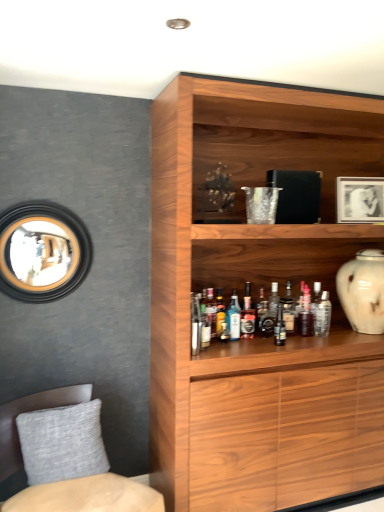
Question: Is translucent glass bottle at shelf center, positioned as the sixth bottle in right-to-left order, wider or thinner than translucent glass bottle at center, placed as the 1th bottle when sorted from left to right?

Choices:
 (A) wide
 (B) thin

Answer: (B)

Question: Considering their positions, is translucent glass bottle at shelf center, positioned as the sixth bottle in right-to-left order, located in front of or behind translucent glass bottle at center, the ninth bottle when ordered from right to left?

Choices:
 (A) behind
 (B) front

Answer: (A)

Question: Which object is the farthest from the wooden cabinet at upper center?

Choices:
 (A) clear glass bottle at shelf center, which is counted as the 9th bottle, starting from the left
 (B) shiny dark brown bottle at center, which is the 5th bottle from left to right
 (C) blue glass bottle at center, acting as the third bottle starting from the left
 (D) white glossy picture frame at upper right
 (E) translucent glass bottle at center, placed as the 1th bottle when sorted from left to right

Answer: (A)

Question: Considering the real-world distances, which object is closest to the clear glass bottle at shelf center, marked as the first bottle in a right-to-left arrangement?

Choices:
 (A) matte glass bottle at center, which is the 3th bottle from right to left
 (B) translucent glass bottle at shelf center, positioned as the sixth bottle in right-to-left order
 (C) gray fabric pillow at lower left
 (D) translucent glass bottle at shelf center, arranged as the 6th bottle when viewed from the left
 (E) white glossy picture frame at upper right

Answer: (A)